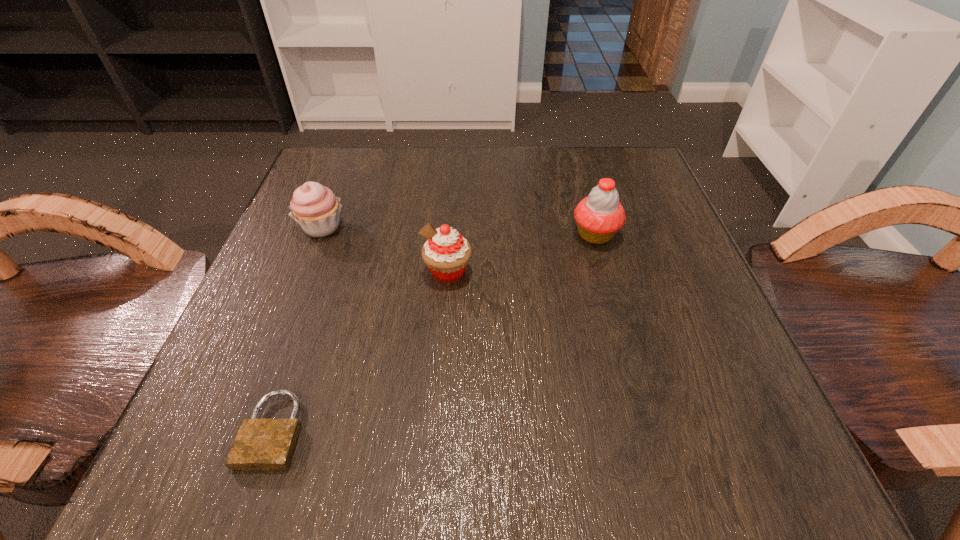
You are a GUI agent. You are given a task and a screenshot of the screen. Output one action in this format:
    pyautogui.click(x=<x>, y=<y>)
    Task: Click on the rightmost object
    The image size is (960, 540).
    Given the screenshot: What is the action you would take?
    pyautogui.click(x=599, y=216)

You are a GUI agent. You are given a task and a screenshot of the screen. Output one action in this format:
    pyautogui.click(x=<x>, y=<y>)
    Task: Click on the nearest cupcake
    This screenshot has width=960, height=540.
    Given the screenshot: What is the action you would take?
    pyautogui.click(x=446, y=253)

Where is `the second cupcake from left to right`? The width and height of the screenshot is (960, 540). the second cupcake from left to right is located at coordinates (446, 253).

Image resolution: width=960 pixels, height=540 pixels. I want to click on the leftmost cupcake, so (x=315, y=207).

Where is `the nearest object`? This screenshot has width=960, height=540. the nearest object is located at coordinates (260, 443).

Where is `padlock`? padlock is located at coordinates (260, 443).

Identify the location of blank space located 0.230m on the back of the rightmost cupcake. The width and height of the screenshot is (960, 540). (573, 156).

Locate an element on the screen. The image size is (960, 540). vacant area located on the left of the second object from right to left is located at coordinates (335, 272).

You are a GUI agent. You are given a task and a screenshot of the screen. Output one action in this format:
    pyautogui.click(x=<x>, y=<y>)
    Task: Click on the free space located on the front of the leftmost cupcake
    
    Given the screenshot: What is the action you would take?
    pyautogui.click(x=278, y=339)

This screenshot has width=960, height=540. I want to click on object located in the near edge section of the desktop, so click(260, 443).